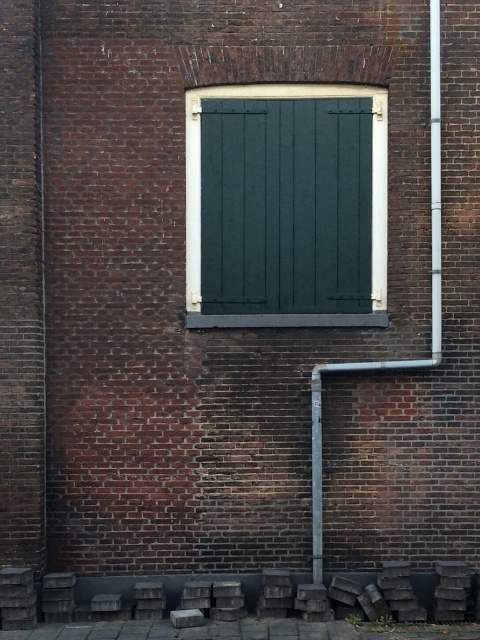
Question: In this image, where is dark green wood at center located relative to white metallic pipe at right?

Choices:
 (A) above
 (B) below

Answer: (B)

Question: Which of these objects is positioned farthest from the metallic gray pole at center?

Choices:
 (A) dark green wood at center
 (B) white metallic pipe at right

Answer: (B)

Question: Does white metallic pipe at right appear under metallic gray pole at center?

Choices:
 (A) yes
 (B) no

Answer: (B)

Question: Which object is closer to the camera taking this photo?

Choices:
 (A) dark green wood at center
 (B) metallic gray pole at center
 (C) white metallic pipe at right

Answer: (B)

Question: Is white metallic pipe at right smaller than metallic gray pole at center?

Choices:
 (A) no
 (B) yes

Answer: (A)

Question: Estimate the real-world distances between objects in this image. Which object is farther from the white metallic pipe at right?

Choices:
 (A) metallic gray pole at center
 (B) dark green wood at center

Answer: (A)